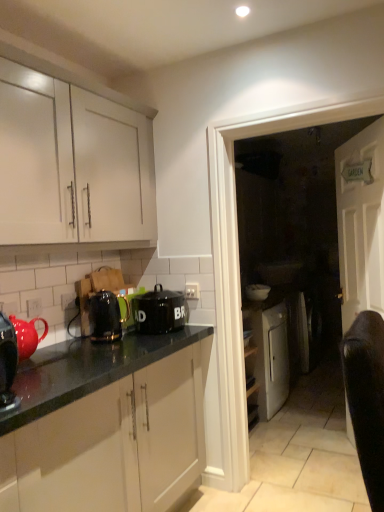
Question: From the image's perspective, does black ceramic canister at center, the 3th kitchen appliance viewed from the left, appear lower than white glossy door at center?

Choices:
 (A) yes
 (B) no

Answer: (A)

Question: Is black ceramic canister at center, the 3th kitchen appliance viewed from the left, further to the viewer compared to white glossy door at center?

Choices:
 (A) yes
 (B) no

Answer: (A)

Question: Does black ceramic canister at center, which is counted as the 1th kitchen appliance, starting from the right, lie in front of white glossy door at center?

Choices:
 (A) yes
 (B) no

Answer: (B)

Question: From a real-world perspective, is black ceramic canister at center, the 3th kitchen appliance viewed from the left, on white glossy door at center?

Choices:
 (A) yes
 (B) no

Answer: (A)

Question: Considering the relative sizes of black ceramic canister at center, which is counted as the 1th kitchen appliance, starting from the right, and white glossy door at center in the image provided, is black ceramic canister at center, which is counted as the 1th kitchen appliance, starting from the right, bigger than white glossy door at center?

Choices:
 (A) yes
 (B) no

Answer: (B)

Question: From the image's perspective, does black ceramic canister at center, which is the third kitchen appliance in front-to-back order, appear higher than white glossy door at center?

Choices:
 (A) no
 (B) yes

Answer: (A)

Question: Does metallic black toaster at center-left, acting as the second kitchen appliance starting from the left, have a lesser height compared to white glossy door at center?

Choices:
 (A) yes
 (B) no

Answer: (A)

Question: Does metallic black toaster at center-left, acting as the second kitchen appliance starting from the left, touch white glossy door at center?

Choices:
 (A) yes
 (B) no

Answer: (B)

Question: Is metallic black toaster at center-left, the second kitchen appliance from the right, wider than white glossy door at center?

Choices:
 (A) no
 (B) yes

Answer: (A)

Question: From the image's perspective, would you say metallic black toaster at center-left, the second kitchen appliance from the right, is shown under white glossy door at center?

Choices:
 (A) no
 (B) yes

Answer: (B)

Question: Considering the relative positions of metallic black toaster at center-left, arranged as the second kitchen appliance when viewed from the back, and white glossy door at center in the image provided, is metallic black toaster at center-left, arranged as the second kitchen appliance when viewed from the back, to the left of white glossy door at center from the viewer's perspective?

Choices:
 (A) no
 (B) yes

Answer: (B)

Question: Is metallic black toaster at center-left, arranged as the second kitchen appliance when viewed from the back, not near white glossy door at center?

Choices:
 (A) yes
 (B) no

Answer: (B)

Question: Does white matte cabinet at upper left have a larger size compared to metallic black toaster at center-left, acting as the second kitchen appliance starting from the left?

Choices:
 (A) no
 (B) yes

Answer: (B)